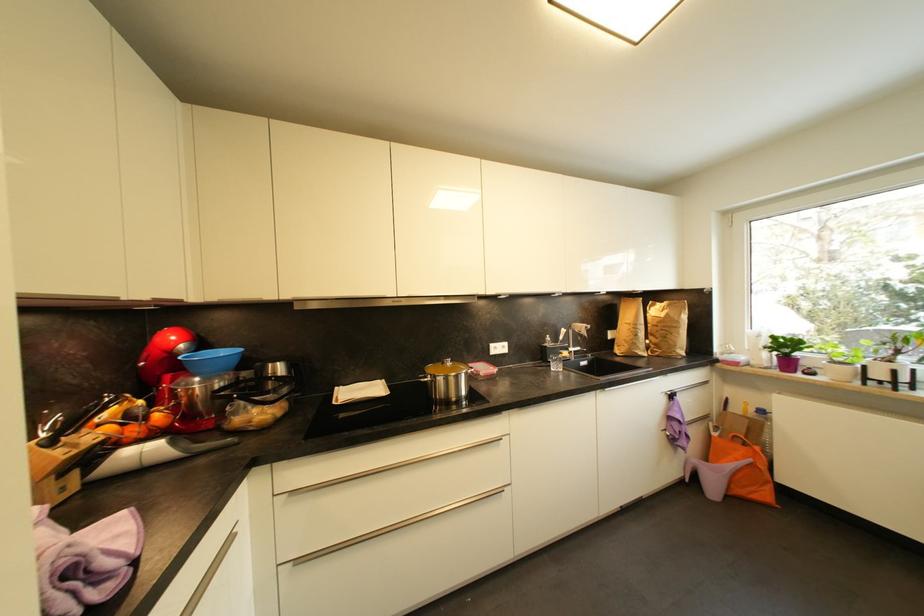
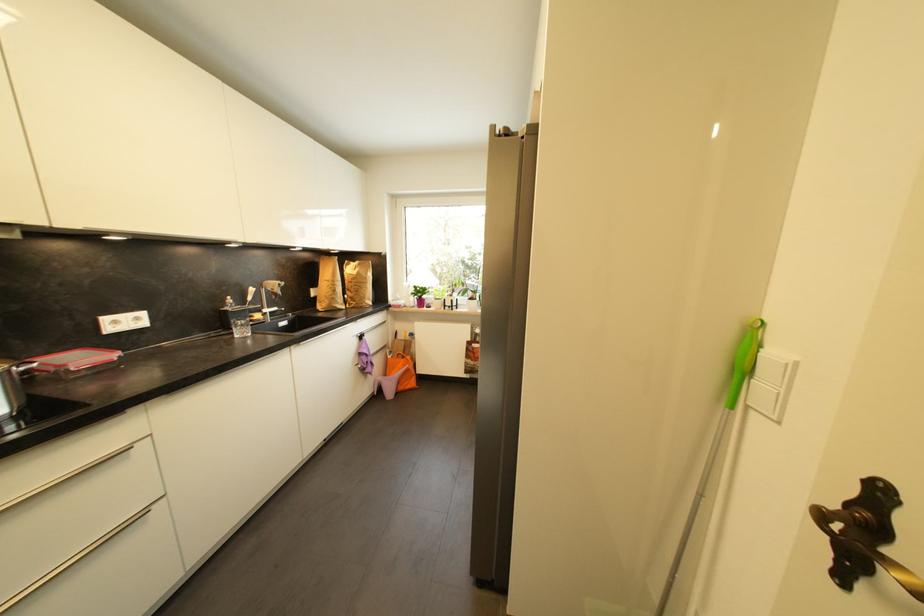
Locate, in the second image, the point that corresponds to pixel 507 349 in the first image.

(142, 321)